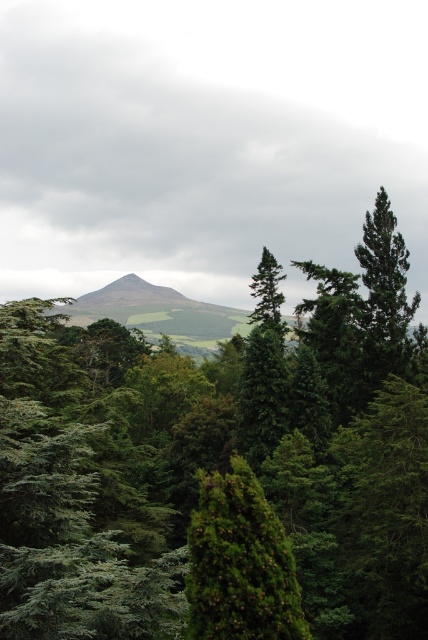
Can you confirm if green leafy trees at center is positioned to the left of green matte tree at upper right?

Indeed, green leafy trees at center is positioned on the left side of green matte tree at upper right.

Between point (317, 449) and point (371, 304), which one is positioned in front?

Point (317, 449) is more forward.

Which is behind, point (329, 602) or point (404, 298)?

Point (404, 298)

Where is `green leafy trees at center`? The width and height of the screenshot is (428, 640). green leafy trees at center is located at coordinates (219, 465).

Does point (234, 608) lie in front of point (267, 424)?

Yes, it is in front of point (267, 424).

Is green leafy trees at center closer to the viewer compared to green matte tree at center?

Yes, it is.

Is point (124, 428) farther from camera compared to point (269, 451)?

That is False.

Identify the location of green leafy trees at center. (219, 465).

Consider the image. Between green matte tree at upper right and green matte tree at center, which one has more height?

green matte tree at center is taller.

Is green matte tree at upper right wider than green matte tree at center?

In fact, green matte tree at upper right might be narrower than green matte tree at center.

Find the location of `green matte tree at upper right`. green matte tree at upper right is located at coordinates (383, 296).